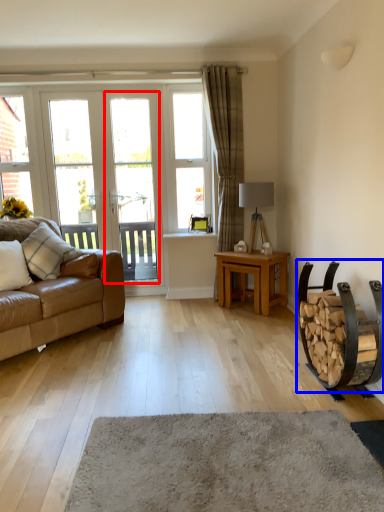
Question: Which of the following is the farthest to the observer, screen door (highlighted by a red box) or armchair (highlighted by a blue box)?

Choices:
 (A) screen door
 (B) armchair

Answer: (A)